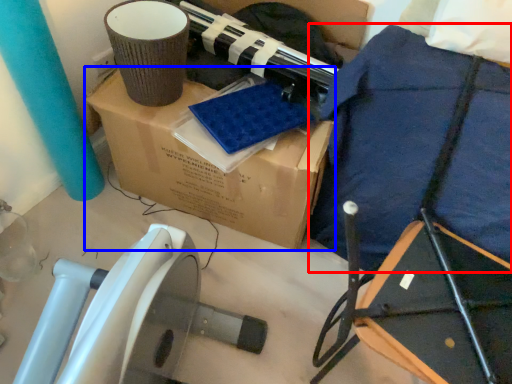
Question: Which object is further to the camera taking this photo, blanket (highlighted by a red box) or box (highlighted by a blue box)?

Choices:
 (A) blanket
 (B) box

Answer: (B)